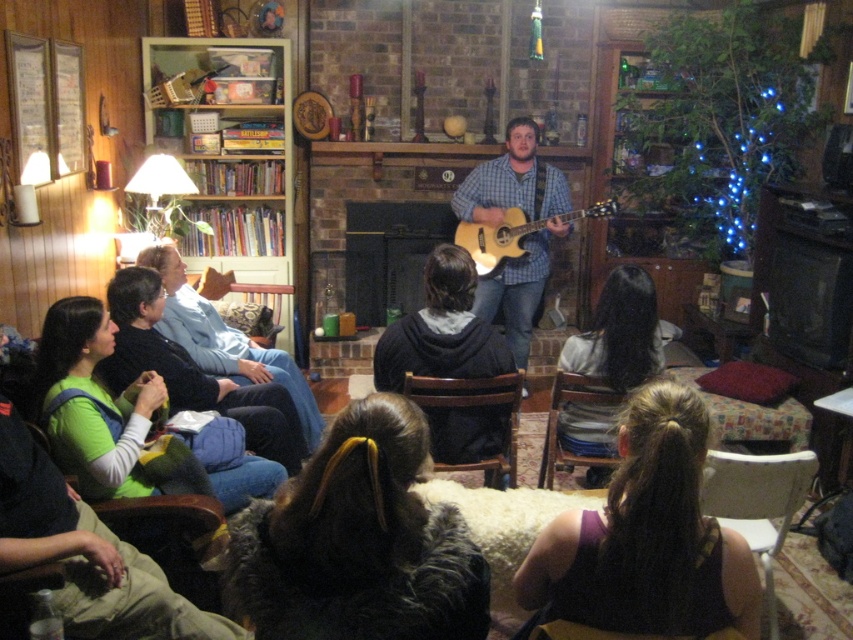
Is point (735, 525) closer to viewer compared to point (613, 460)?

That is True.

Which of these two, white plastic chair at lower right or velvet dark brown armchair at lower center, stands taller?

white plastic chair at lower right is taller.

Who is more distant from viewer, (701, 493) or (546, 449)?

Positioned behind is point (546, 449).

Image resolution: width=853 pixels, height=640 pixels. In order to click on white plastic chair at lower right in this screenshot , I will do `click(757, 502)`.

Does dark brown hair at center appear under black matte fireplace at center?

Correct, dark brown hair at center is located below black matte fireplace at center.

Where is `dark brown hair at center`? Image resolution: width=853 pixels, height=640 pixels. dark brown hair at center is located at coordinates (619, 333).

In the scene shown: Between dark brown hair at center and brown leather armchair at lower left, which one has more height?

dark brown hair at center is taller.

Which is in front, point (618, 321) or point (184, 499)?

Point (184, 499)

Which is behind, point (575, 448) or point (183, 513)?

Point (575, 448)

Image resolution: width=853 pixels, height=640 pixels. In order to click on dark brown hair at center in this screenshot , I will do (x=619, y=333).